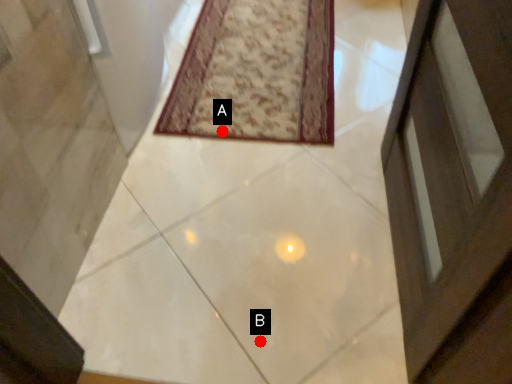
Question: Two points are circled on the image, labeled by A and B beside each circle. Which point is closer to the camera?

Choices:
 (A) A is closer
 (B) B is closer

Answer: (B)